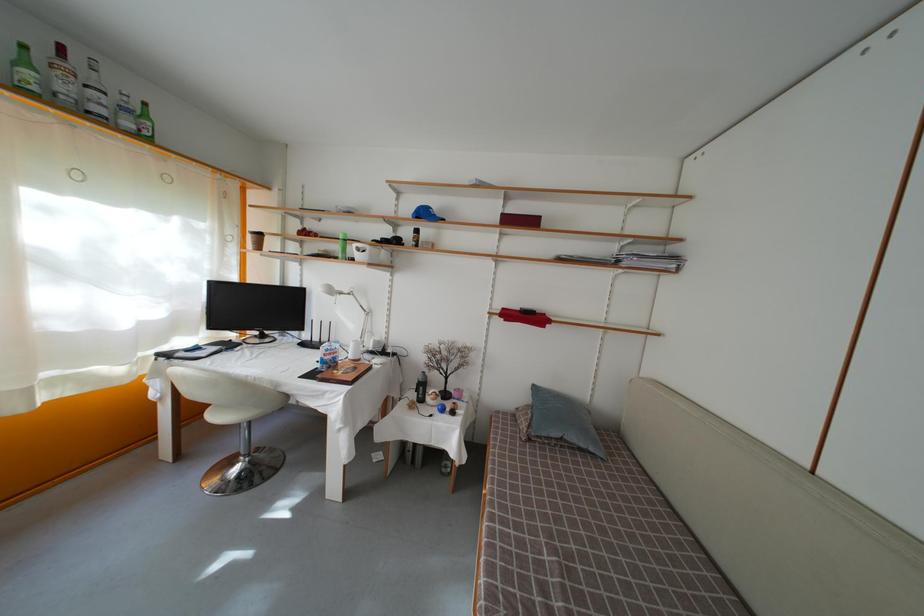
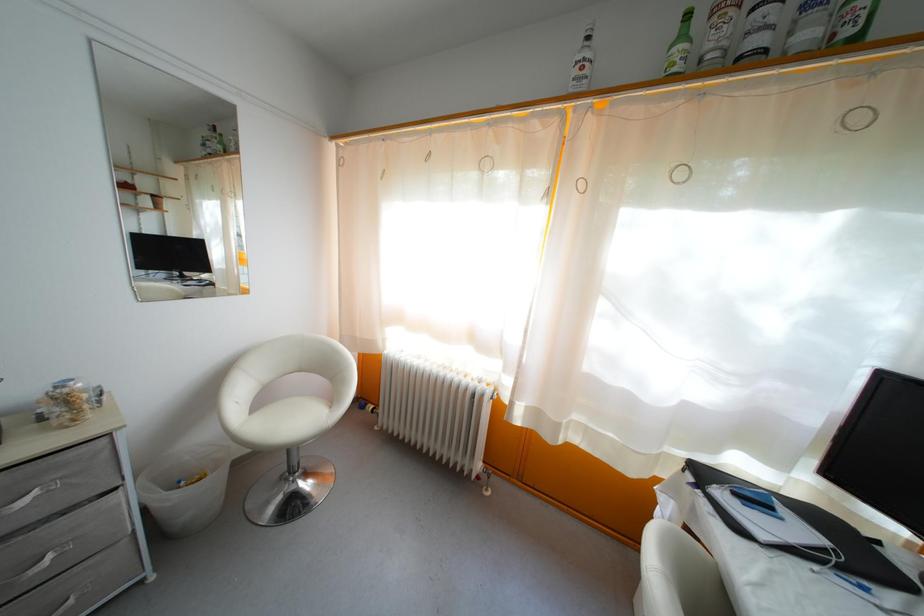
Locate, in the second image, the point that corresponds to [152,140] in the first image.

(854, 39)